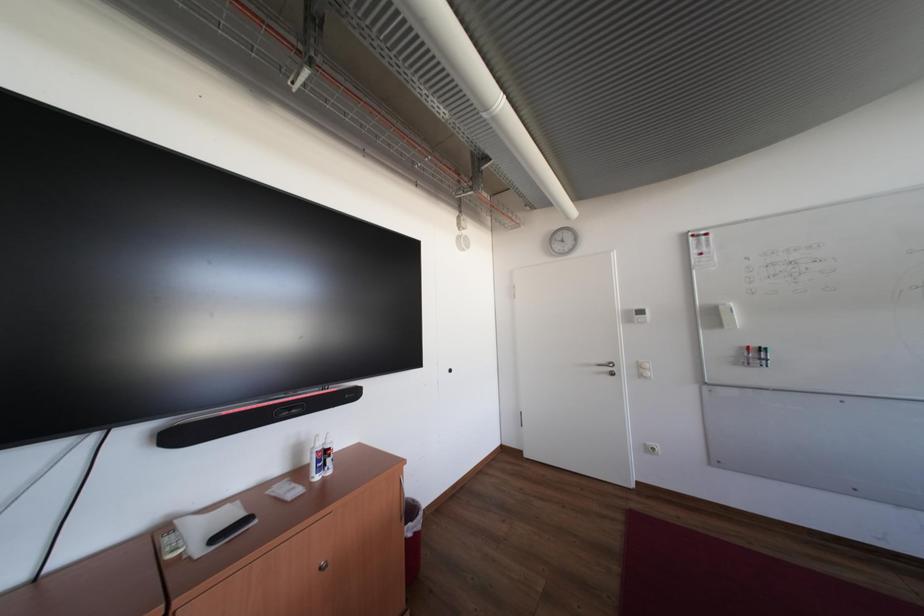
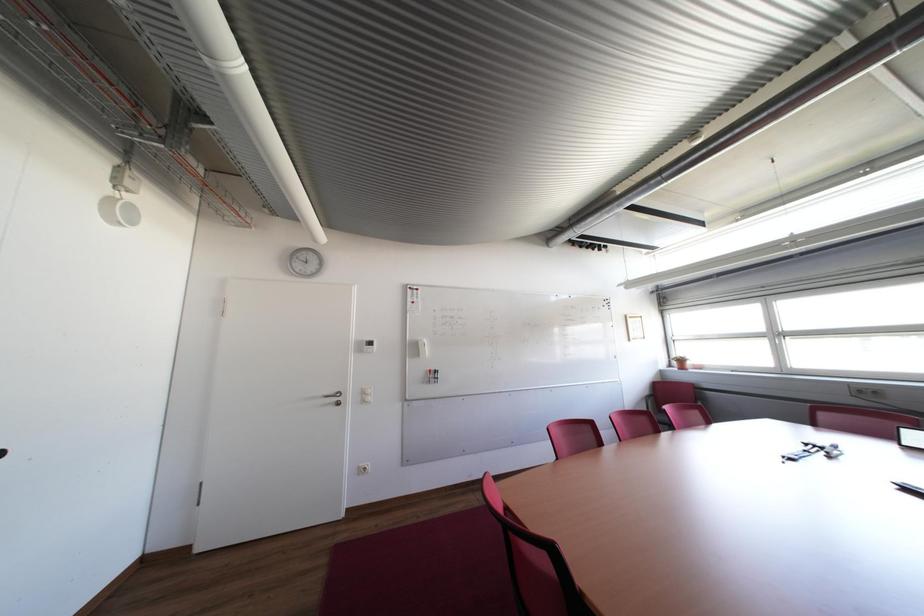
Question: Based on the continuous images, in which direction is the camera rotating? Reply with the corresponding letter.

Choices:
 (A) Left
 (B) Right
 (C) Up
 (D) Down

Answer: (B)